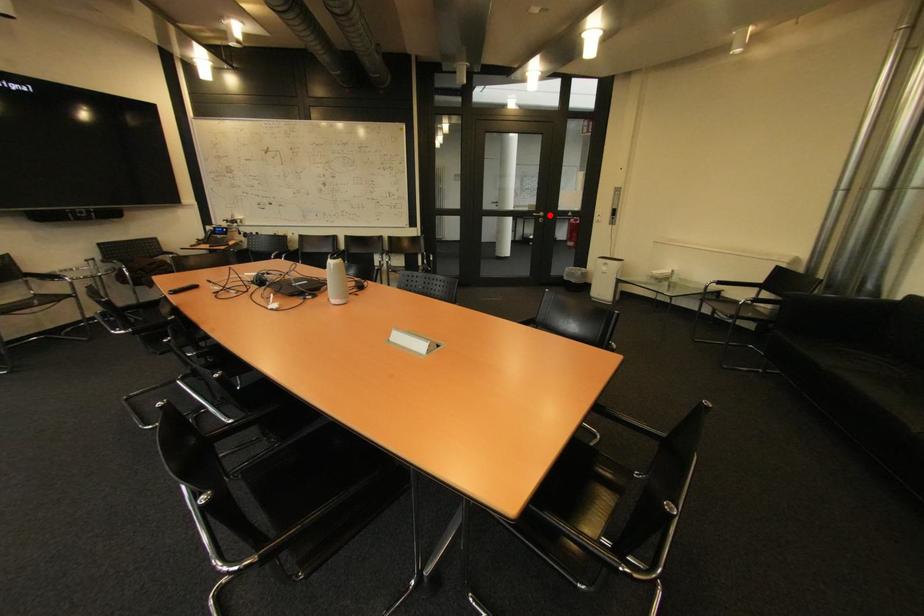
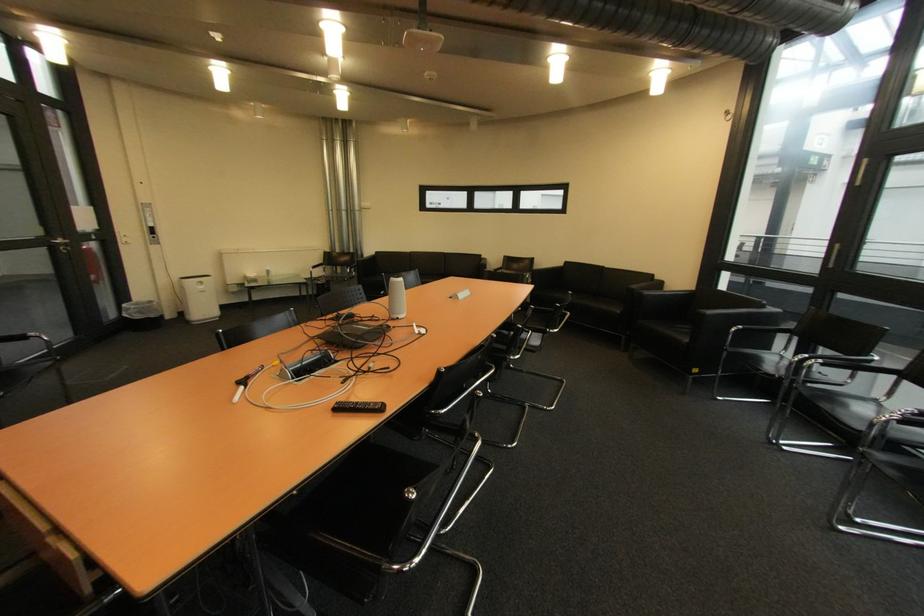
Question: I am providing you with two images of the same scene from different viewpoints. A red point is shown in image1. For the corresponding object point in image2, is it positioned nearer or farther from the camera?

Choices:
 (A) Nearer
 (B) Farther

Answer: (B)